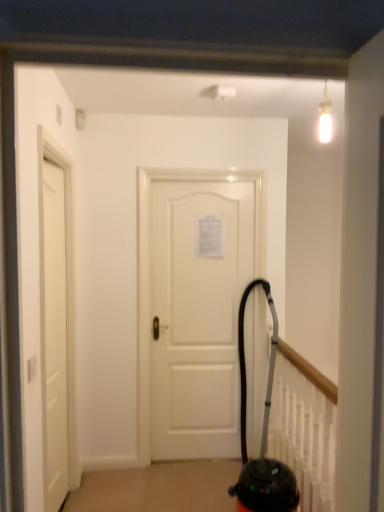
At what (x,y) coordinates should I click in order to perform the action: click on free space in front of white matte door at center, the first door viewed from the back. Please return your answer as a coordinate pair (x, y). The image size is (384, 512). Looking at the image, I should click on (185, 493).